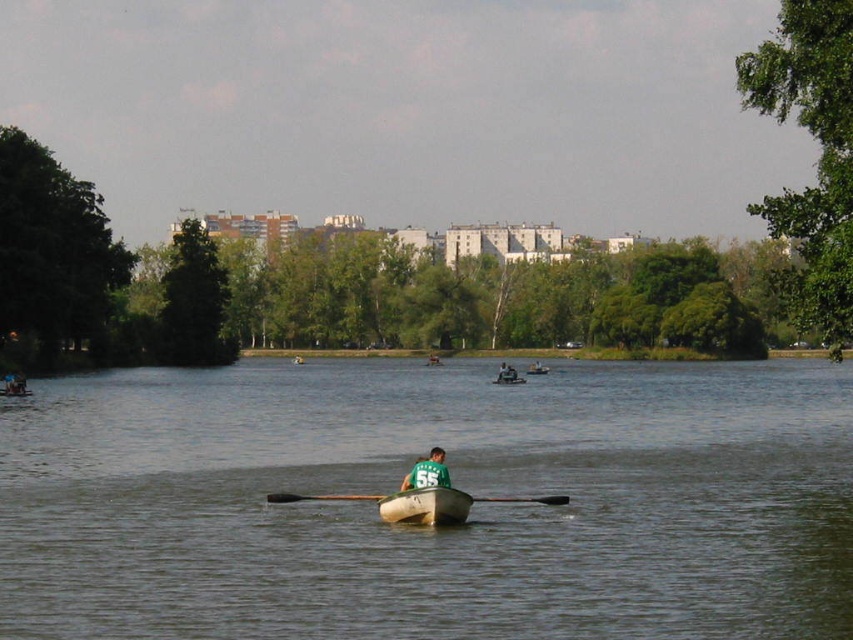
Which is below, green jersey at center or white plastic canoe at center?

green jersey at center is below.

Can you confirm if green jersey at center is taller than white plastic canoe at center?

Indeed, green jersey at center has a greater height compared to white plastic canoe at center.

Describe the element at coordinates (427, 472) in the screenshot. I see `green jersey at center` at that location.

Image resolution: width=853 pixels, height=640 pixels. In order to click on green jersey at center in this screenshot , I will do [427, 472].

Image resolution: width=853 pixels, height=640 pixels. Identify the location of green jersey at center. (427, 472).

Which is more to the left, green jersey at center or green fabric shirt at center?

From the viewer's perspective, green jersey at center appears more on the left side.

Identify the location of green jersey at center. (427, 472).

Is point (288, 499) closer to viewer compared to point (421, 461)?

No, (288, 499) is behind (421, 461).

Looking at this image, between wooden smooth paddle at center and green jersey at center, which one has more height?

Standing taller between the two is green jersey at center.

Who is more forward, (287, 500) or (407, 481)?

Point (407, 481)

What are the coordinates of `wooden smooth paddle at center` in the screenshot? It's located at (318, 497).